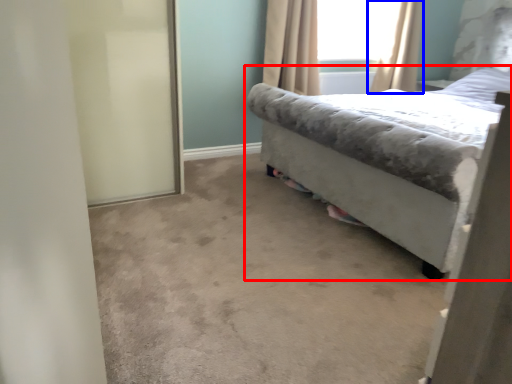
Question: Which of the following is the closest to the observer, bed (highlighted by a red box) or curtain (highlighted by a blue box)?

Choices:
 (A) bed
 (B) curtain

Answer: (A)